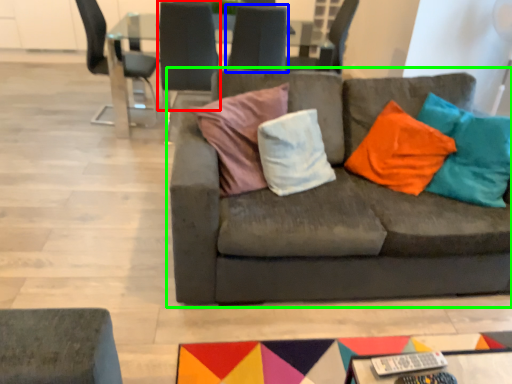
Question: Considering the real-world distances, which object is farthest from chair (highlighted by a red box)? chair (highlighted by a blue box) or studio couch (highlighted by a green box)?

Choices:
 (A) chair
 (B) studio couch

Answer: (B)